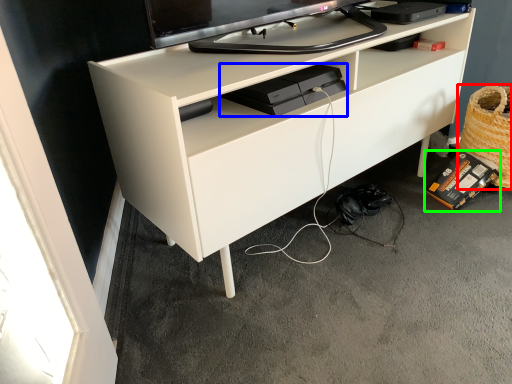
Question: Estimate the real-world distances between objects in this image. Which object is farther from basket (highlighted by a red box), equipment (highlighted by a blue box) or equipment (highlighted by a green box)?

Choices:
 (A) equipment
 (B) equipment

Answer: (A)